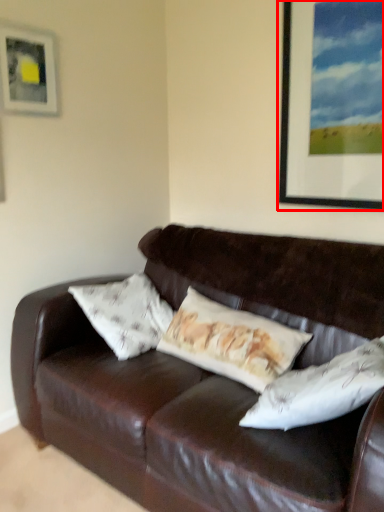
Question: Observing the image, what is the correct spatial positioning of picture frame (annotated by the red box) in reference to picture frame?

Choices:
 (A) left
 (B) right

Answer: (B)